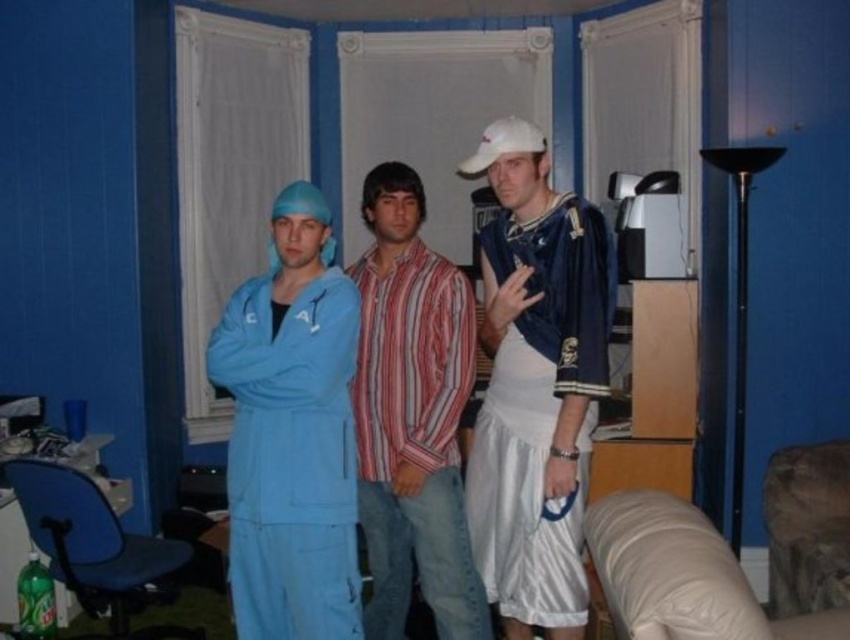
Consider the image. You are standing in the room and want to reach both the point at coordinates (547, 193) and the point at coordinates (425, 384). Which point will you reach first if you move straight towards them?

You will reach point (547, 193) first because it is closer to you than point (425, 384).

You are standing in the room and want to pick up the white matte baseball cap at upper center. Based on its coordinates, where exactly should you look to find it?

The white matte baseball cap at upper center is located at point coordinates of (536, 385).

You are standing in the room and want to place a small decorative item exactly at the position where the white matte baseball cap at upper center is located. According to the coordinates provided, what are the exact coordinates where you should place the item?

The exact coordinates to place the small decorative item are at point [536,385], as specified by the white matte baseball cap at upper center.